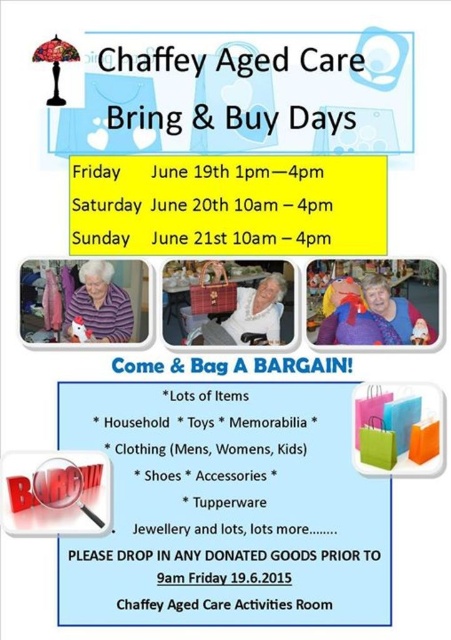
Question: Which of the following is the closest to the observer?

Choices:
 (A) purple striped sweater at center
 (B) white fabric chair at center

Answer: (A)

Question: Is white fabric chair at center above orange matte shopping bag at lower right?

Choices:
 (A) no
 (B) yes

Answer: (B)

Question: Estimate the real-world distances between objects in this image. Which object is closer to the white paper bag at center?

Choices:
 (A) matte pink sweater at center
 (B) matte purple sweater at center
 (C) white paper at center

Answer: (C)

Question: Which is farther from the purple striped sweater at center?

Choices:
 (A) green paper shopping bag at lower right
 (B) white fabric chair at center

Answer: (A)

Question: Does white paper at center appear on the right side of orange matte shopping bag at lower right?

Choices:
 (A) yes
 (B) no

Answer: (B)

Question: Does purple striped sweater at center have a larger size compared to white fabric chair at center?

Choices:
 (A) no
 (B) yes

Answer: (A)